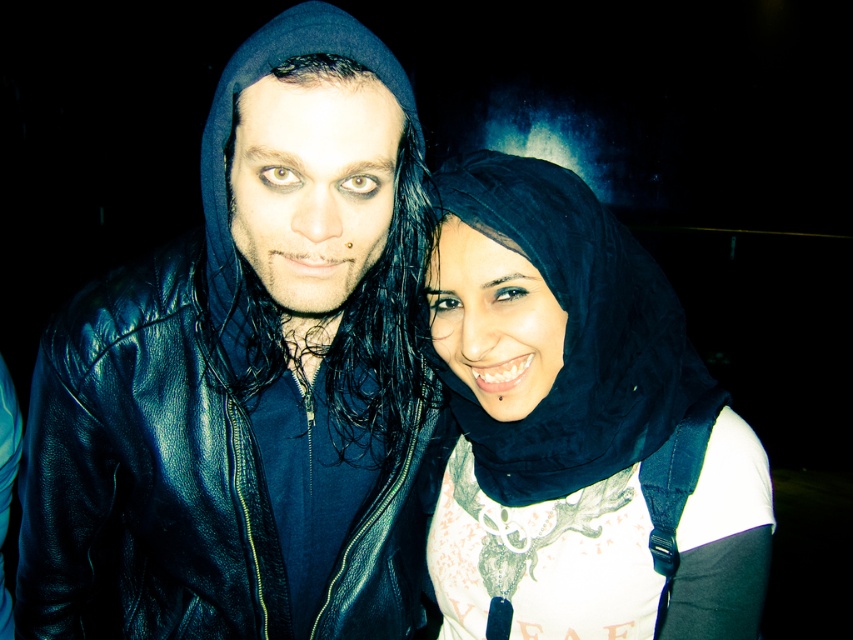
Question: Which point is farther from the camera taking this photo?

Choices:
 (A) (271, 176)
 (B) (467, 225)

Answer: (B)

Question: Can you confirm if black leather jacket at left is positioned to the right of black matte hijab at center?

Choices:
 (A) no
 (B) yes

Answer: (A)

Question: Can you confirm if black leather jacket at left is bigger than black matte hijab at center?

Choices:
 (A) yes
 (B) no

Answer: (A)

Question: Which of the following is the farthest from the observer?

Choices:
 (A) (231, 570)
 (B) (537, 512)

Answer: (B)

Question: Observing the image, what is the correct spatial positioning of black leather jacket at left in reference to black matte hijab at center?

Choices:
 (A) right
 (B) left

Answer: (B)